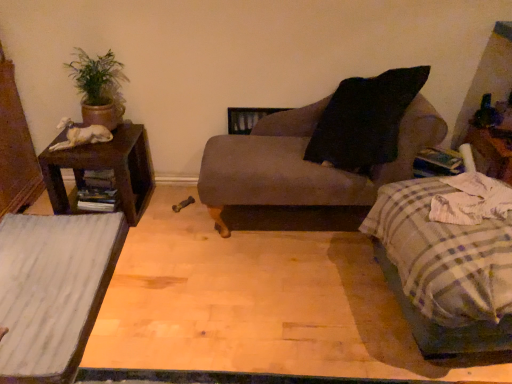
Where is `free region under matte gray chaise at center (from a real-world perspective)`? This screenshot has height=384, width=512. free region under matte gray chaise at center (from a real-world perspective) is located at coordinates (285, 221).